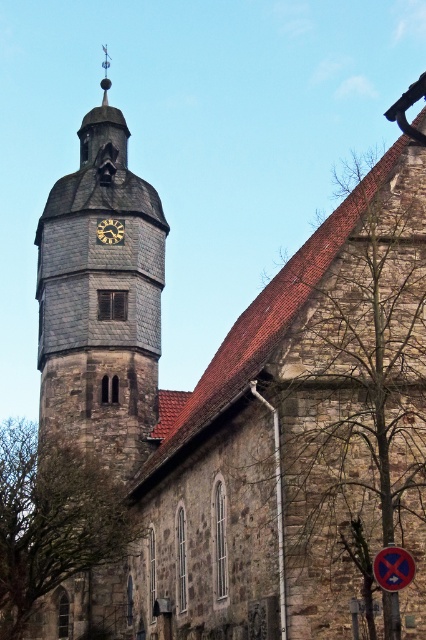
Question: Which of the following is the farthest from the observer?

Choices:
 (A) (109, 225)
 (B) (106, 81)
 (C) (60, 394)

Answer: (B)

Question: Is matte gray clock at center behind shiny metal spire at upper center?

Choices:
 (A) yes
 (B) no

Answer: (B)

Question: Does stone clock tower at center appear on the left side of matte gray clock at center?

Choices:
 (A) no
 (B) yes

Answer: (B)

Question: Estimate the real-world distances between objects in this image. Which object is farther from the shiny metal spire at upper center?

Choices:
 (A) matte gray clock at center
 (B) metallic reflective sign at center

Answer: (B)

Question: Is stone clock tower at center to the left of shiny metal spire at upper center from the viewer's perspective?

Choices:
 (A) yes
 (B) no

Answer: (B)

Question: Which of the following is the closest to the observer?

Choices:
 (A) matte gray clock at center
 (B) shiny metal spire at upper center
 (C) stone clock tower at center
 (D) metallic reflective sign at center

Answer: (D)